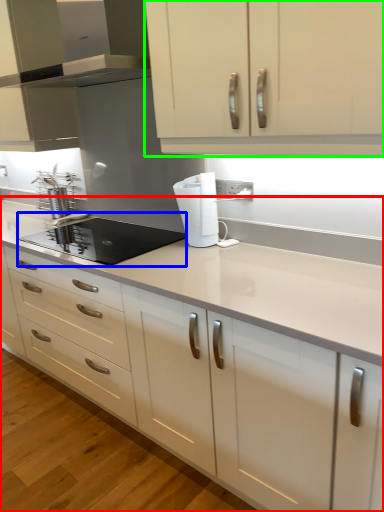
Question: Based on their relative distances, which object is nearer to countertop (highlighted by a red box)? Choose from kitchen appliance (highlighted by a blue box) and cabinetry (highlighted by a green box).

Choices:
 (A) kitchen appliance
 (B) cabinetry

Answer: (A)